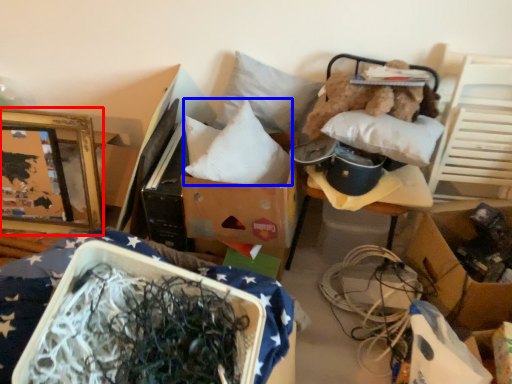
Question: Among these objects, which one is nearest to the camera, picture frame (highlighted by a red box) or pillow (highlighted by a blue box)?

Choices:
 (A) picture frame
 (B) pillow

Answer: (B)